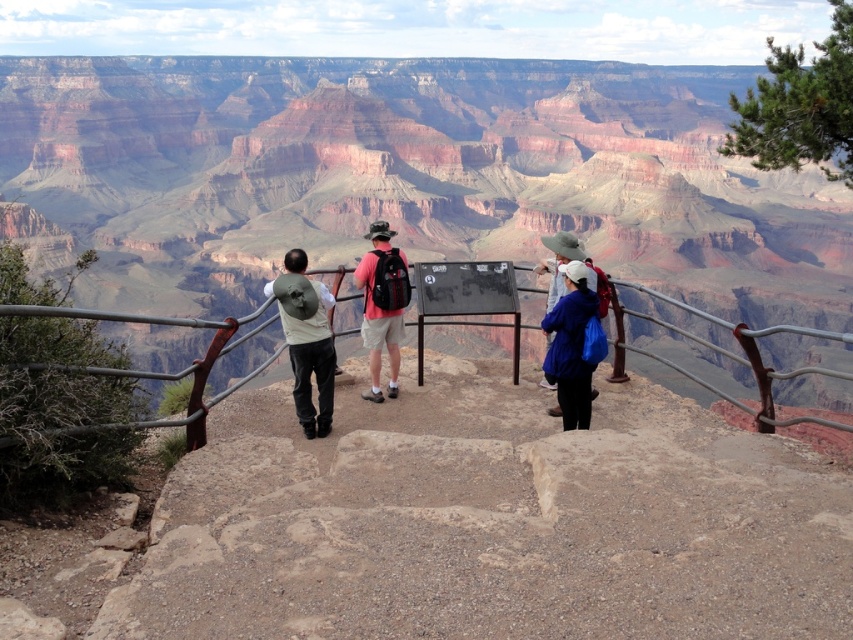
Which is more to the right, metallic gray railing at center or matte green backpack at center?

Positioned to the right is metallic gray railing at center.

Where is `metallic gray railing at center`? The height and width of the screenshot is (640, 853). metallic gray railing at center is located at coordinates (740, 358).

Who is more distant from viewer, (x=297, y=372) or (x=387, y=292)?

Point (x=387, y=292)

Who is more forward, (x=306, y=356) or (x=396, y=330)?

Point (x=306, y=356) is in front.

The width and height of the screenshot is (853, 640). I want to click on matte green backpack at center, so click(308, 346).

Based on the photo, is metallic gray railing at center below matte pink shirt at center?

Indeed, metallic gray railing at center is positioned under matte pink shirt at center.

Does metallic gray railing at center have a lesser width compared to matte pink shirt at center?

In fact, metallic gray railing at center might be wider than matte pink shirt at center.

Is point (125, 371) in front of point (376, 339)?

Yes, it is in front of point (376, 339).

Identify the location of metallic gray railing at center. (740, 358).